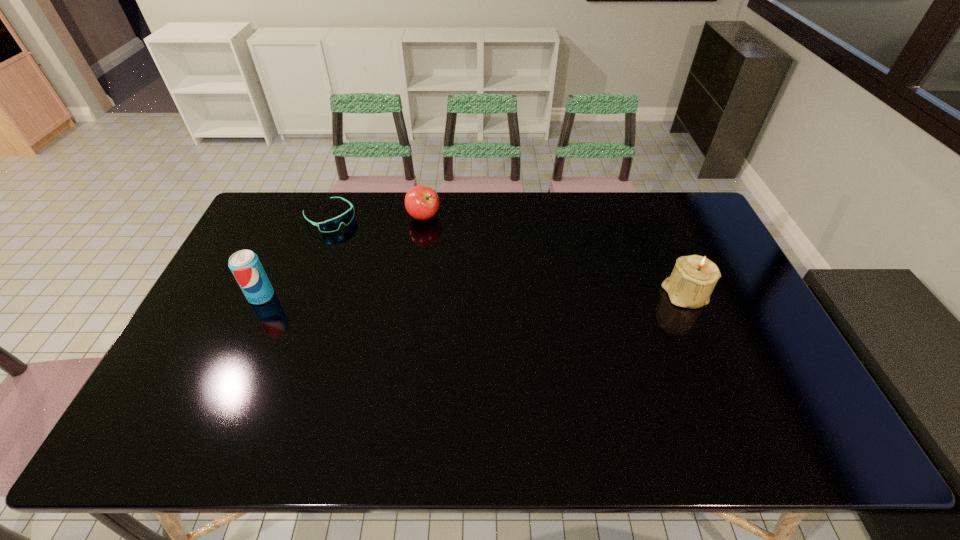
Identify the location of vacant space located on the front-facing side of the sunglasses. (404, 280).

Find the location of `free space located 0.220m on the front-facing side of the sunglasses`. free space located 0.220m on the front-facing side of the sunglasses is located at coordinates (381, 261).

I want to click on vacant space located on the front-facing side of the sunglasses, so click(379, 259).

In order to click on apple that is at the far edge in this screenshot , I will do `click(421, 202)`.

Find the location of `sunglasses at the far edge`. sunglasses at the far edge is located at coordinates (331, 225).

Identify the location of object positioned at the left edge. This screenshot has width=960, height=540. (245, 265).

Image resolution: width=960 pixels, height=540 pixels. What are the coordinates of `object that is at the right edge` in the screenshot? It's located at (692, 281).

The width and height of the screenshot is (960, 540). I want to click on vacant space at the far edge of the desktop, so click(329, 200).

Where is `vacant position at the near edge of the desktop`? The width and height of the screenshot is (960, 540). vacant position at the near edge of the desktop is located at coordinates (548, 377).

The width and height of the screenshot is (960, 540). What are the coordinates of `vacant space at the left edge of the desktop` in the screenshot? It's located at (234, 347).